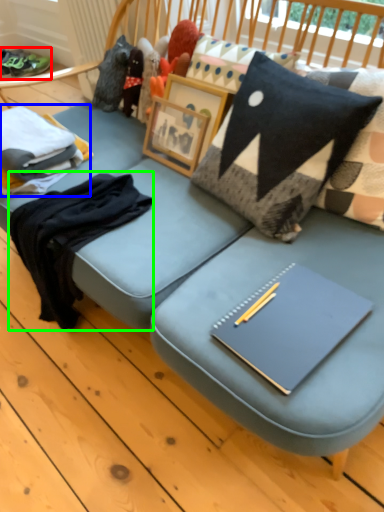
Question: Which object is the closest to the footwear (highlighted by a red box)? Choose among these: clothing (highlighted by a blue box) or clothing (highlighted by a green box).

Choices:
 (A) clothing
 (B) clothing

Answer: (A)